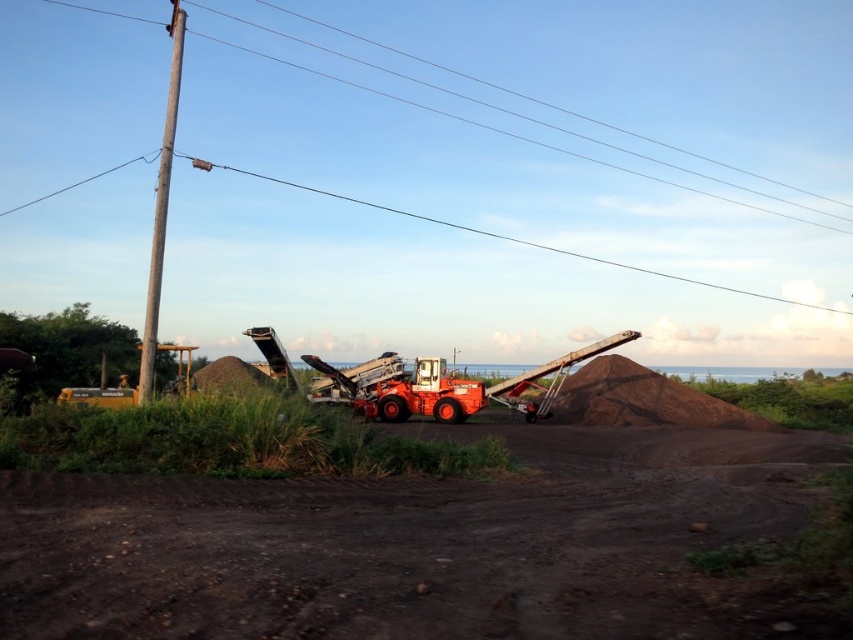
Is dirt track at center closer to the viewer compared to brown wooden telegraph pole at left?

Yes, it is in front of brown wooden telegraph pole at left.

Does point (379, 621) come in front of point (138, 362)?

Yes, it is in front of point (138, 362).

Is point (503, 561) closer to camera compared to point (161, 259)?

Yes, it is.

This screenshot has width=853, height=640. I want to click on dirt track at center, so click(424, 545).